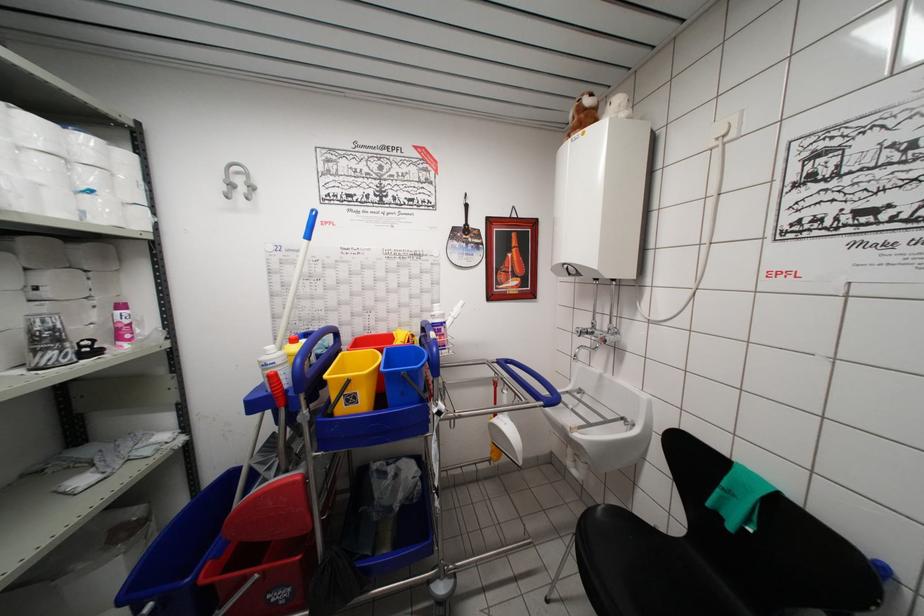
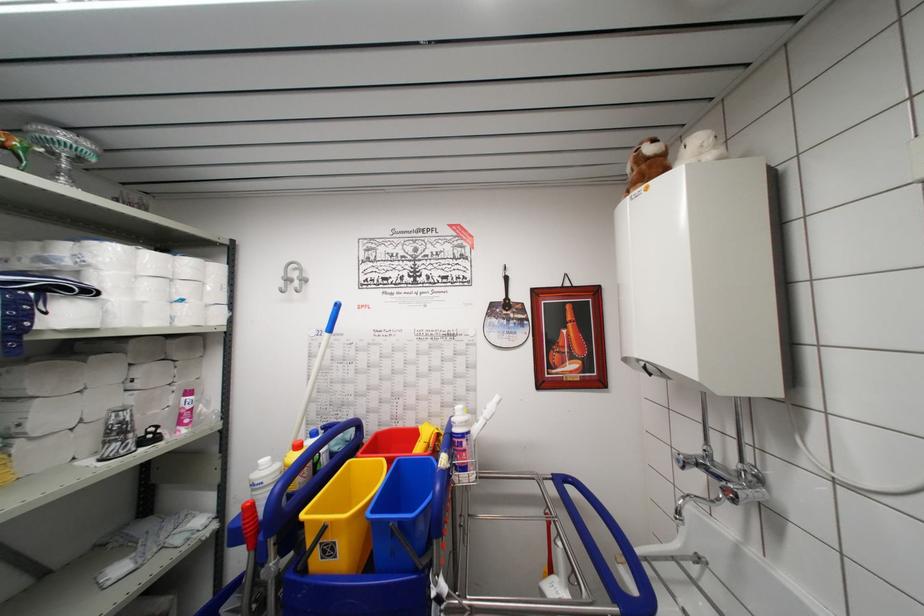
Where in the second image is the point corresponding to point (412, 338) from the first image?

(439, 436)